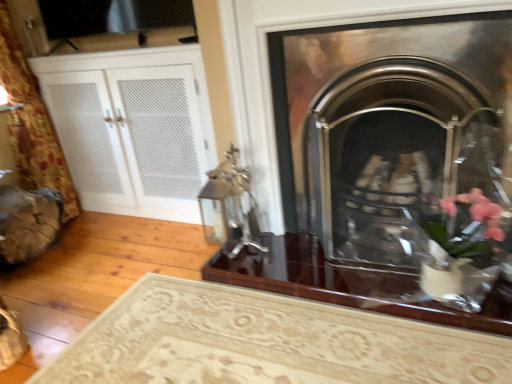
The height and width of the screenshot is (384, 512). Describe the element at coordinates (378, 154) in the screenshot. I see `polished chrome fireplace at center, positioned as the second fireplace in bottom-to-top order` at that location.

Find the location of `glossy dark wood table at center`. glossy dark wood table at center is located at coordinates (348, 283).

You are a GUI agent. You are given a task and a screenshot of the screen. Output one action in this format:
    pyautogui.click(x=<x>, y=<y>)
    Task: Click on the polished chrome fireplace at center, arranged as the 1th fireplace when viewed from the top
    The width and height of the screenshot is (512, 384).
    Given the screenshot: What is the action you would take?
    pyautogui.click(x=378, y=154)

From a real-world perspective, does polished chrome fireplace at center, arranged as the 1th fireplace when viewed from the top, sit lower than glossy dark wood table at center?

Actually, polished chrome fireplace at center, arranged as the 1th fireplace when viewed from the top, is physically above glossy dark wood table at center in the real world.

Which object is further away from the camera taking this photo, polished chrome fireplace at center, positioned as the second fireplace in bottom-to-top order, or glossy dark wood table at center?

glossy dark wood table at center is further away from the camera.

From the image's perspective, between polished chrome fireplace at center, positioned as the second fireplace in bottom-to-top order, and glossy dark wood table at center, which one is located above?

polished chrome fireplace at center, positioned as the second fireplace in bottom-to-top order, appears higher in the image.

From the picture: Can you confirm if wooden log at lower left is shorter than polished chrome fireplace at center, positioned as the second fireplace in bottom-to-top order?

Correct, wooden log at lower left is not as tall as polished chrome fireplace at center, positioned as the second fireplace in bottom-to-top order.

Considering the positions of objects wooden log at lower left and polished chrome fireplace at center, positioned as the second fireplace in bottom-to-top order, in the image provided, who is behind, wooden log at lower left or polished chrome fireplace at center, positioned as the second fireplace in bottom-to-top order,?

Positioned behind is wooden log at lower left.

Is wooden log at lower left facing towards polished chrome fireplace at center, positioned as the second fireplace in bottom-to-top order?

Yes, wooden log at lower left is aimed at polished chrome fireplace at center, positioned as the second fireplace in bottom-to-top order.

Who is more distant, wooden log at lower left or black mesh screen at upper left?

black mesh screen at upper left.

In the scene shown: Is wooden log at lower left next to black mesh screen at upper left and touching it?

They are not placed beside each other.

From the picture: In terms of size, does wooden log at lower left appear bigger or smaller than black mesh screen at upper left?

In the image, wooden log at lower left appears to be smaller than black mesh screen at upper left.

Consider the image. From a real-world perspective, between wooden log at lower left and black mesh screen at upper left, who is vertically higher?

From a 3D spatial view, black mesh screen at upper left is above.

Who is smaller, polished chrome fireplace at center, arranged as the 1th fireplace when viewed from the top, or polished metal fireplace at center, which appears as the second fireplace when viewed from the top?

With smaller size is polished metal fireplace at center, which appears as the second fireplace when viewed from the top.

Does polished chrome fireplace at center, arranged as the 1th fireplace when viewed from the top, appear on the left side of polished metal fireplace at center, which appears as the second fireplace when viewed from the top?

Indeed, polished chrome fireplace at center, arranged as the 1th fireplace when viewed from the top, is positioned on the left side of polished metal fireplace at center, which appears as the second fireplace when viewed from the top.

Which is correct: polished chrome fireplace at center, positioned as the second fireplace in bottom-to-top order, is inside polished metal fireplace at center, arranged as the 1th fireplace when ordered from the bottom, or outside of it?

polished chrome fireplace at center, positioned as the second fireplace in bottom-to-top order, is not enclosed by polished metal fireplace at center, arranged as the 1th fireplace when ordered from the bottom.

From the image's perspective, is glossy dark wood table at center located beneath white mesh cabinet at left?

Indeed, from the image's perspective, glossy dark wood table at center is shown beneath white mesh cabinet at left.

Is glossy dark wood table at center behind white mesh cabinet at left?

No, glossy dark wood table at center is in front of white mesh cabinet at left.

Does glossy dark wood table at center turn towards white mesh cabinet at left?

No, glossy dark wood table at center is not oriented towards white mesh cabinet at left.

Does point (350, 282) come in front of point (11, 230)?

Yes, it is.

In the scene shown: Does polished chrome fireplace at center, arranged as the 1th fireplace when viewed from the top, have a lesser width compared to wooden log at lower left?

Indeed, polished chrome fireplace at center, arranged as the 1th fireplace when viewed from the top, has a lesser width compared to wooden log at lower left.

From a real-world perspective, who is located lower, polished chrome fireplace at center, positioned as the second fireplace in bottom-to-top order, or wooden log at lower left?

From a 3D spatial view, wooden log at lower left is below.

Based on the photo, in terms of height, does polished chrome fireplace at center, positioned as the second fireplace in bottom-to-top order, look taller or shorter compared to wooden log at lower left?

Considering their sizes, polished chrome fireplace at center, positioned as the second fireplace in bottom-to-top order, has more height than wooden log at lower left.

Which object is positioned more to the right, wooden log at lower left or white mesh cabinet at left?

white mesh cabinet at left.

Considering the sizes of wooden log at lower left and white mesh cabinet at left in the image, is wooden log at lower left wider or thinner than white mesh cabinet at left?

Considering their sizes, wooden log at lower left looks slimmer than white mesh cabinet at left.

Find the location of a particular element. This screenshot has width=512, height=384. the 2nd fireplace in front of the glossy dark wood table at center is located at coordinates (378, 154).

Locate an element on the screen. Image resolution: width=512 pixels, height=384 pixels. chair that appears behind the polished chrome fireplace at center, positioned as the second fireplace in bottom-to-top order is located at coordinates (27, 222).

Estimate the real-world distances between objects in this image. Which object is closer to white mesh cabinet at left, glossy dark wood table at center or black mesh screen at upper left?

black mesh screen at upper left.

Considering their positions, is glossy dark wood table at center positioned closer to black mesh screen at upper left than white mesh cabinet at left?

white mesh cabinet at left lies closer to black mesh screen at upper left than the other object.

From the image, which object appears to be farther from glossy dark wood table at center, wooden log at lower left or polished chrome fireplace at center, arranged as the 1th fireplace when viewed from the top?

The object further to glossy dark wood table at center is wooden log at lower left.

Estimate the real-world distances between objects in this image. Which object is closer to polished metal fireplace at center, which appears as the second fireplace when viewed from the top, polished chrome fireplace at center, arranged as the 1th fireplace when viewed from the top, or glossy dark wood table at center?

polished chrome fireplace at center, arranged as the 1th fireplace when viewed from the top, is closer to polished metal fireplace at center, which appears as the second fireplace when viewed from the top.

When comparing their distances from wooden log at lower left, does glossy dark wood table at center or white mesh cabinet at left seem further?

glossy dark wood table at center is positioned further to the anchor wooden log at lower left.

Looking at the image, which one is located closer to white mesh cabinet at left, polished chrome fireplace at center, positioned as the second fireplace in bottom-to-top order, or glossy dark wood table at center?

polished chrome fireplace at center, positioned as the second fireplace in bottom-to-top order, is positioned closer to the anchor white mesh cabinet at left.

Which object lies further to the anchor point wooden log at lower left, black mesh screen at upper left or glossy dark wood table at center?

Based on the image, glossy dark wood table at center appears to be further to wooden log at lower left.

From the image, which object appears to be nearer to black mesh screen at upper left, wooden log at lower left or glossy dark wood table at center?

Among the two, wooden log at lower left is located nearer to black mesh screen at upper left.

You are a GUI agent. You are given a task and a screenshot of the screen. Output one action in this format:
    pyautogui.click(x=<x>, y=<y>)
    Task: Click on the dresser located between black mesh screen at upper left and polished chrome fireplace at center, positioned as the second fireplace in bottom-to-top order, in the left-right direction
    
    Given the screenshot: What is the action you would take?
    pyautogui.click(x=133, y=128)

This screenshot has width=512, height=384. I want to click on table between black mesh screen at upper left and polished chrome fireplace at center, positioned as the second fireplace in bottom-to-top order, from left to right, so click(348, 283).

Where is `table between black mesh screen at upper left and polished metal fireplace at center, which appears as the second fireplace when viewed from the top, in the horizontal direction`? table between black mesh screen at upper left and polished metal fireplace at center, which appears as the second fireplace when viewed from the top, in the horizontal direction is located at coordinates (348, 283).

Find the location of a particular element. This screenshot has height=384, width=512. table between white mesh cabinet at left and polished metal fireplace at center, which appears as the second fireplace when viewed from the top, in the horizontal direction is located at coordinates (348, 283).